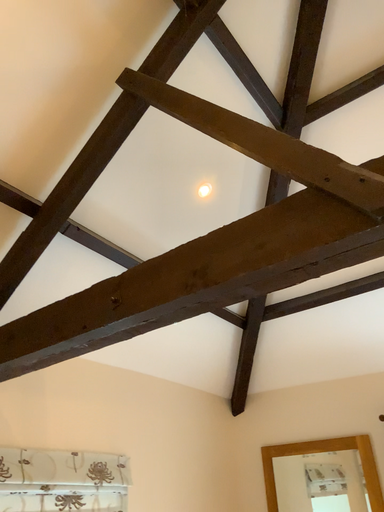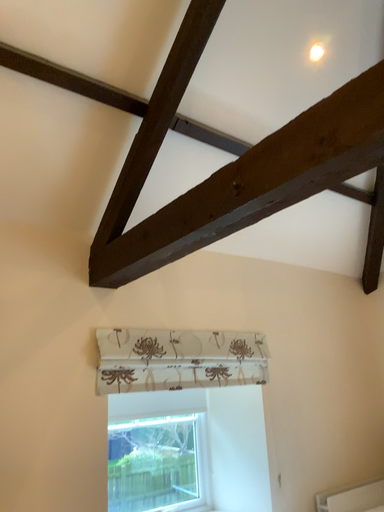
Question: Which way did the camera rotate in the video?

Choices:
 (A) rotated left
 (B) rotated right

Answer: (A)